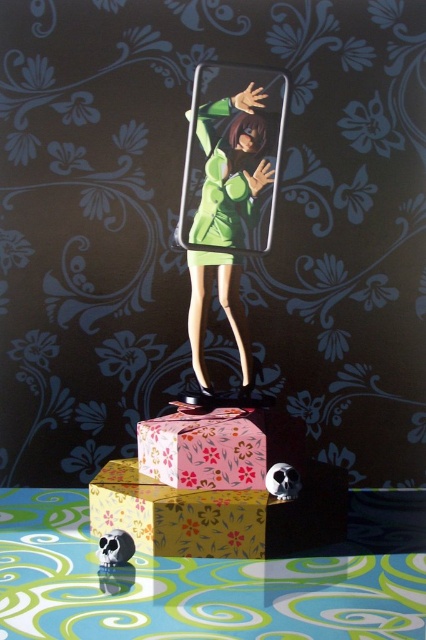
Which is more to the right, pink floral paper box at center or matte black skull at lower left?

pink floral paper box at center is more to the right.

Where is `pink floral paper box at center`? pink floral paper box at center is located at coordinates (204, 449).

Find the location of a particular element. pink floral paper box at center is located at coordinates (204, 449).

Between green matte figure at center and matte black skull at lower left, which one appears on the right side from the viewer's perspective?

From the viewer's perspective, green matte figure at center appears more on the right side.

Does green matte figure at center have a lesser height compared to matte black skull at lower left?

In fact, green matte figure at center may be taller than matte black skull at lower left.

Which is in front, point (271, 177) or point (120, 561)?

Point (120, 561) is more forward.

Where is `green matte figure at center`? The image size is (426, 640). green matte figure at center is located at coordinates (232, 168).

Between point (206, 253) and point (198, 484), which one is positioned in front?

Point (198, 484) is in front.

Between green matte figure at center and pink floral paper box at center, which one appears on the right side from the viewer's perspective?

Positioned to the right is green matte figure at center.

Which is in front, point (258, 116) or point (178, 442)?

Point (178, 442)

You are a GUI agent. You are given a task and a screenshot of the screen. Output one action in this format:
    pyautogui.click(x=<x>, y=<y>)
    Task: Click on the green matte figure at center
    
    Given the screenshot: What is the action you would take?
    pyautogui.click(x=232, y=168)